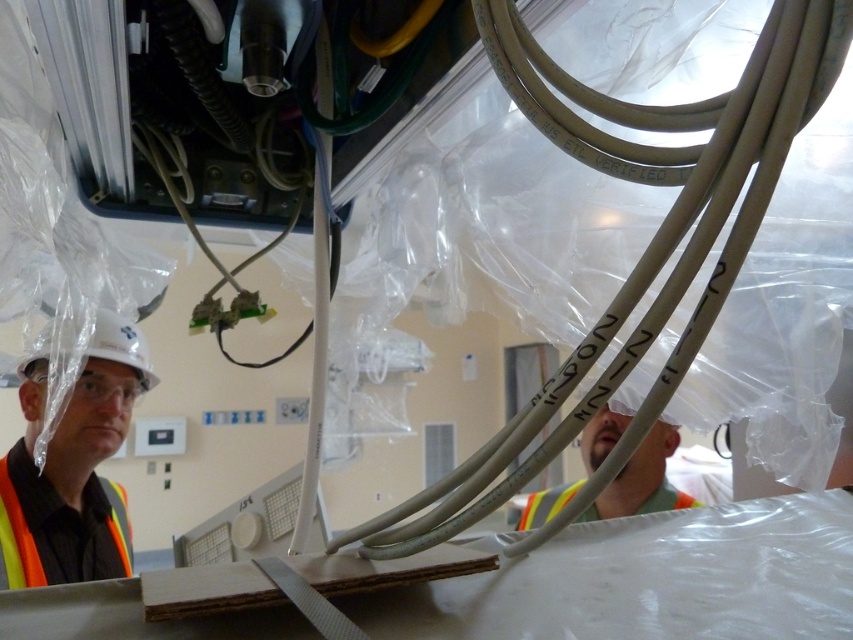
What do you see at coordinates (646, 246) in the screenshot? I see `beige rubber cable at center` at bounding box center [646, 246].

Does point (564, 144) come farther from viewer compared to point (38, 477)?

That is False.

I want to click on beige rubber cable at center, so click(646, 246).

Looking at this image, can you confirm if matte white hard hat at left is positioned to the left of orange reflective safety vest at lower left?

In fact, matte white hard hat at left is to the right of orange reflective safety vest at lower left.

Between point (32, 516) and point (33, 547), which one is positioned in front?

Positioned in front is point (33, 547).

The height and width of the screenshot is (640, 853). In order to click on matte white hard hat at left in this screenshot , I will do `click(73, 467)`.

This screenshot has height=640, width=853. What are the coordinates of `matte white hard hat at left` in the screenshot? It's located at (73, 467).

Which is below, beige rubber cable at center or reflective silver helmet at center?

reflective silver helmet at center is lower down.

Does point (517, 440) come farther from viewer compared to point (616, 476)?

No, it is not.

The width and height of the screenshot is (853, 640). I want to click on beige rubber cable at center, so click(x=646, y=246).